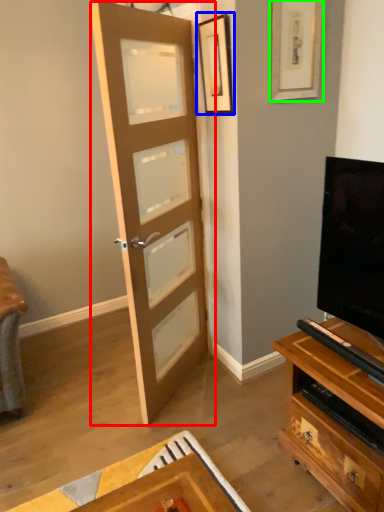
Question: Which object is the farthest from door (highlighted by a red box)? Choose among these: picture frame (highlighted by a blue box) or picture frame (highlighted by a green box).

Choices:
 (A) picture frame
 (B) picture frame

Answer: (B)